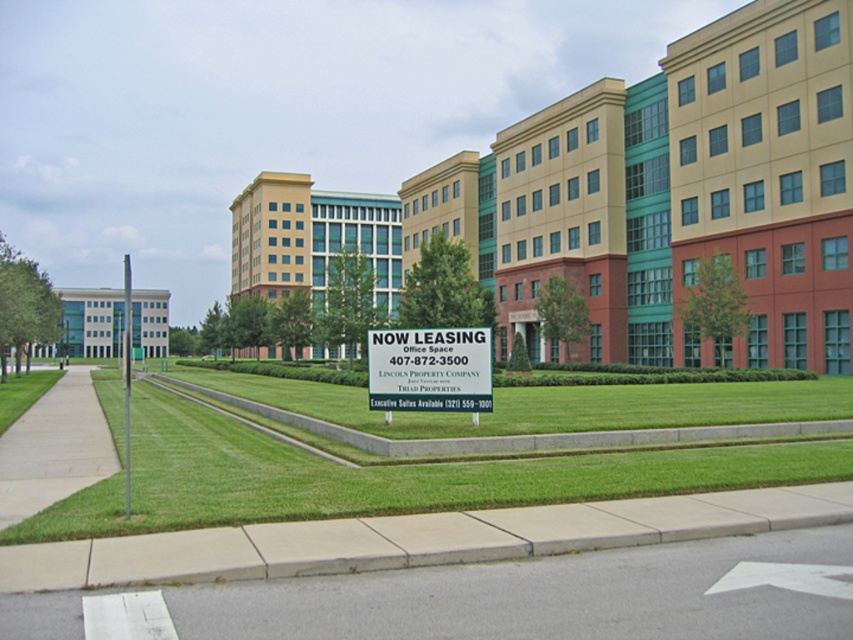
Consider the image. You are a delivery driver approaching the building complex and need to park your vehicle. The parking area is marked by the gray asphalt at lower center. However, there is a white plastic sign at center in the way. Can you drive over the sign to access the parking area?

The gray asphalt at lower center is positioned under the white plastic sign at center, meaning the sign is above the parking area. Therefore, you cannot drive over the sign to access the parking area because it is elevated and likely placed on a pole or structure over the asphalt.

You are a delivery driver approaching the commercial building complex. You need to park your truck, which is 1.5 meters tall, in the parking area marked by the gray asphalt at lower center. Can your truck fit under the white plastic sign at center located in the middle of the lawn?

The gray asphalt at lower center is shorter than the white plastic sign at center. Since the truck is 1.5 meters tall and the asphalt area is shorter than the sign, it implies the sign is taller than 1.5 meters. Therefore, the truck can safely pass under the white plastic sign at center as it is taller than the truck.

You are standing on the lawn in front of the NOW LEASING sign. You need to walk to the gray asphalt at lower center. According to the image, in which direction should you walk from your current position?

The gray asphalt at lower center is located at point (538,596), so you should walk towards the lower center direction from your current position on the lawn.